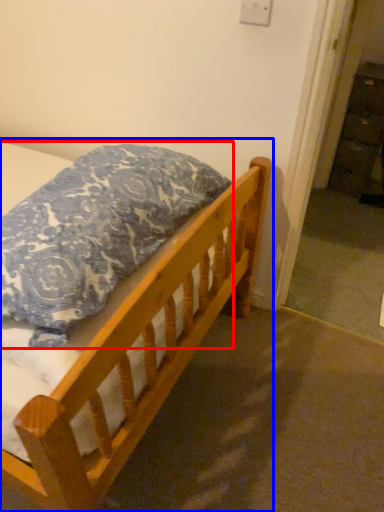
Question: Which point is further to the camera, pillow (highlighted by a red box) or bed (highlighted by a blue box)?

Choices:
 (A) pillow
 (B) bed

Answer: (B)